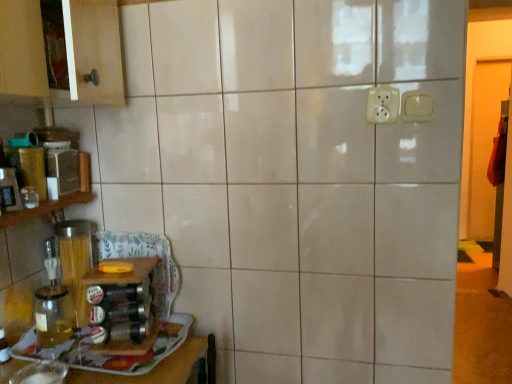
Question: From a real-world perspective, is white plastic electric outlet at upper center, which ranks as the second electric outlet in right-to-left order, located higher than matte plastic container at left?

Choices:
 (A) no
 (B) yes

Answer: (B)

Question: Is white plastic electric outlet at upper center, which ranks as the second electric outlet in right-to-left order, oriented away from matte plastic container at left?

Choices:
 (A) no
 (B) yes

Answer: (A)

Question: Does white plastic electric outlet at upper center, which ranks as the second electric outlet in right-to-left order, appear on the left side of matte plastic container at left?

Choices:
 (A) no
 (B) yes

Answer: (A)

Question: Does white plastic electric outlet at upper center, which ranks as the second electric outlet in right-to-left order, have a greater width compared to matte plastic container at left?

Choices:
 (A) no
 (B) yes

Answer: (A)

Question: Are white plastic electric outlet at upper center, marked as the 1th electric outlet in a left-to-right arrangement, and matte plastic container at left far apart?

Choices:
 (A) yes
 (B) no

Answer: (B)

Question: From the image's perspective, is matte plastic container at left located above or below transparent glass jar at left?

Choices:
 (A) above
 (B) below

Answer: (A)

Question: Is matte plastic container at left in front of or behind transparent glass jar at left in the image?

Choices:
 (A) front
 (B) behind

Answer: (B)

Question: Looking at the image, does matte plastic container at left seem bigger or smaller compared to transparent glass jar at left?

Choices:
 (A) big
 (B) small

Answer: (A)

Question: Is matte plastic container at left situated inside transparent glass jar at left or outside?

Choices:
 (A) outside
 (B) inside

Answer: (A)

Question: From the image's perspective, is transparent glass jar at lower left positioned above or below white plastic switch at upper right, which is counted as the second electric outlet, starting from the left?

Choices:
 (A) above
 (B) below

Answer: (B)

Question: From a real-world perspective, is transparent glass jar at lower left physically located above or below white plastic switch at upper right, which is counted as the second electric outlet, starting from the left?

Choices:
 (A) above
 (B) below

Answer: (B)

Question: Looking at their shapes, would you say transparent glass jar at lower left is wider or thinner than white plastic switch at upper right, which is the first electric outlet from right to left?

Choices:
 (A) wide
 (B) thin

Answer: (A)

Question: Considering their positions, is transparent glass jar at lower left located in front of or behind white plastic switch at upper right, which is the first electric outlet from right to left?

Choices:
 (A) front
 (B) behind

Answer: (A)

Question: From the image's perspective, is matte plastic container at left located above or below transparent glass jar at lower left?

Choices:
 (A) below
 (B) above

Answer: (B)

Question: Would you say matte plastic container at left is to the left or to the right of transparent glass jar at lower left in the picture?

Choices:
 (A) left
 (B) right

Answer: (A)